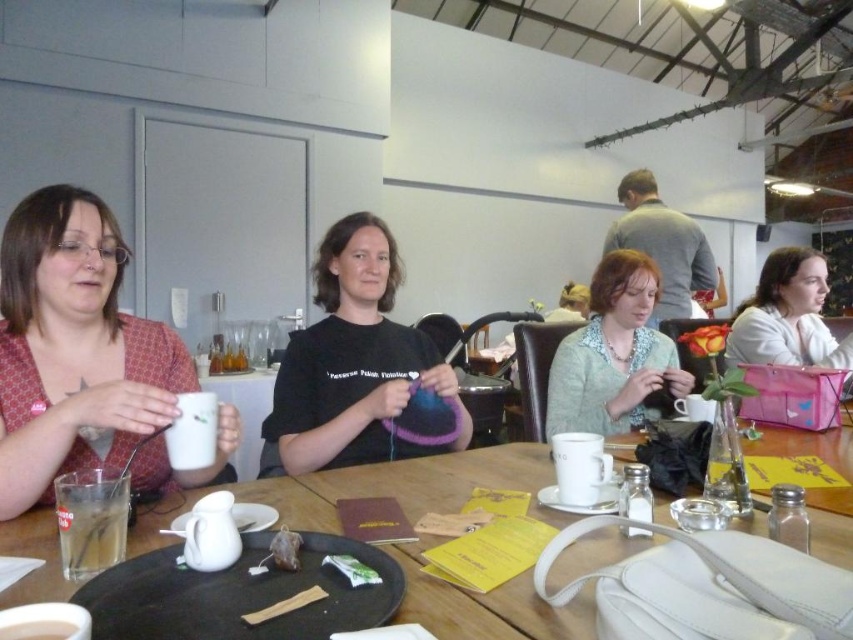
Looking at this image, is matte white mug at left bigger than light green knitwear at center?

Yes, matte white mug at left is bigger than light green knitwear at center.

Can you confirm if matte white mug at left is wider than light green knitwear at center?

Correct, the width of matte white mug at left exceeds that of light green knitwear at center.

Is point (59, 259) closer to camera compared to point (618, 388)?

Yes, it is in front of point (618, 388).

Identify the location of matte white mug at left. The height and width of the screenshot is (640, 853). (74, 348).

Can you confirm if pink fabric purse at right is positioned below brown paper bag at center?

Incorrect, pink fabric purse at right is not positioned below brown paper bag at center.

Between point (784, 276) and point (297, 547), which one is positioned in front?

Point (297, 547) is more forward.

Find the location of a particular element. pink fabric purse at right is located at coordinates (788, 317).

Between point (502, 461) and point (115, 496), which one is positioned behind?

The point (502, 461) is more distant.

Consider the image. Who is more distant from viewer, (x=845, y=556) or (x=90, y=486)?

The point (x=845, y=556) is behind.

Locate an element on the screen. This screenshot has width=853, height=640. wooden table at center is located at coordinates (369, 488).